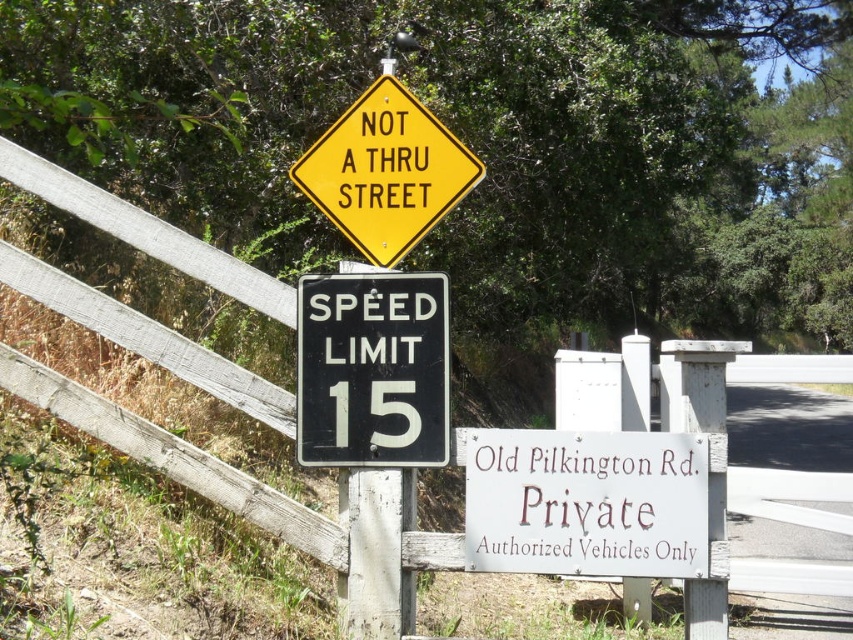
Is white painted wood sign at lower center further to camera compared to black glossy speed limit sign at center?

No, it is not.

Is white painted wood sign at lower center taller than black glossy speed limit sign at center?

No, white painted wood sign at lower center is not taller than black glossy speed limit sign at center.

What do you see at coordinates (585, 502) in the screenshot? I see `white painted wood sign at lower center` at bounding box center [585, 502].

This screenshot has width=853, height=640. What are the coordinates of `white painted wood sign at lower center` in the screenshot? It's located at (585, 502).

Which is more to the left, white painted wood sign at lower center or yellow diamond-shaped sign at upper center?

From the viewer's perspective, yellow diamond-shaped sign at upper center appears more on the left side.

Can you confirm if white painted wood sign at lower center is positioned below yellow diamond-shaped sign at upper center?

Correct, white painted wood sign at lower center is located below yellow diamond-shaped sign at upper center.

Find the location of a particular element. white painted wood sign at lower center is located at coordinates (585, 502).

Who is more distant from viewer, (x=419, y=323) or (x=370, y=160)?

Positioned behind is point (x=370, y=160).

Is black glossy speed limit sign at center thinner than yellow diamond-shaped sign at upper center?

Indeed, black glossy speed limit sign at center has a lesser width compared to yellow diamond-shaped sign at upper center.

Is point (316, 369) positioned behind point (309, 177)?

No, (316, 369) is in front of (309, 177).

You are a GUI agent. You are given a task and a screenshot of the screen. Output one action in this format:
    pyautogui.click(x=<x>, y=<y>)
    Task: Click on the black glossy speed limit sign at center
    The width and height of the screenshot is (853, 640).
    Given the screenshot: What is the action you would take?
    pyautogui.click(x=372, y=369)